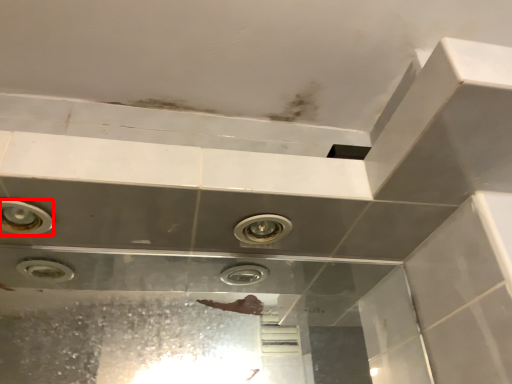
Question: In this image, where is bubble (annotated by the red box) located relative to plumbing fixture?

Choices:
 (A) left
 (B) right

Answer: (A)